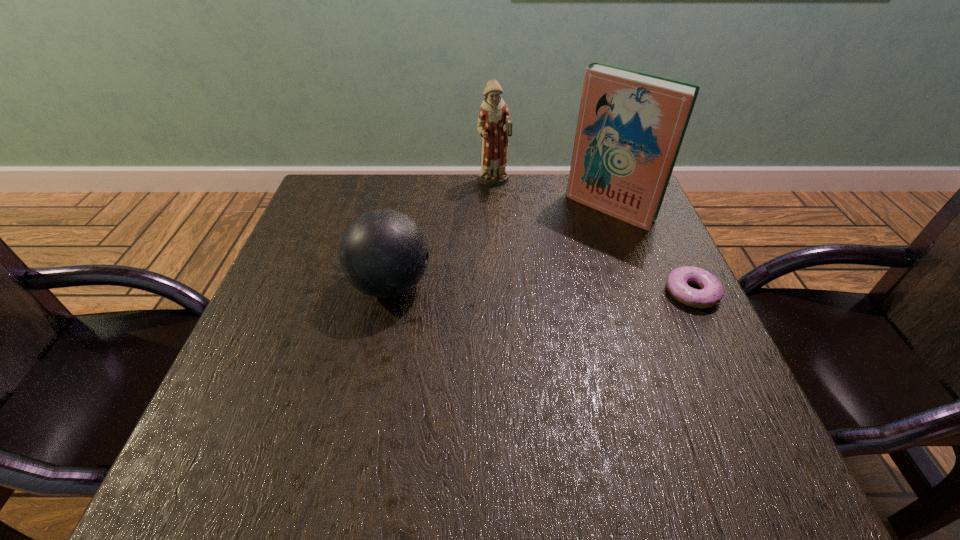
The width and height of the screenshot is (960, 540). What are the coordinates of `vacant space that is in between the figurine and the doughnut` in the screenshot? It's located at (592, 238).

Find the location of a particular element. This screenshot has height=540, width=960. free spot between the hardback book and the doughnut is located at coordinates [651, 251].

Find the location of a particular element. The image size is (960, 540). free point between the shortest object and the tallest object is located at coordinates (651, 251).

Locate an element on the screen. free spot between the third object from right to left and the hardback book is located at coordinates (552, 195).

The height and width of the screenshot is (540, 960). I want to click on free space that is in between the shortest object and the figurine, so click(592, 238).

What are the coordinates of `object that is the second closest one to the bowling ball` in the screenshot? It's located at (631, 125).

I want to click on the second closest object relative to the shortest object, so click(x=494, y=125).

In order to click on free point that satisfies the following two spatial constraints: 1. on the front side of the shortest object; 2. on the right side of the third shortest object in this screenshot , I will do `click(497, 292)`.

What are the coordinates of `vacant area in the image that satisfies the following two spatial constraints: 1. on the front side of the second tallest object; 2. on the right side of the tallest object` in the screenshot? It's located at (494, 208).